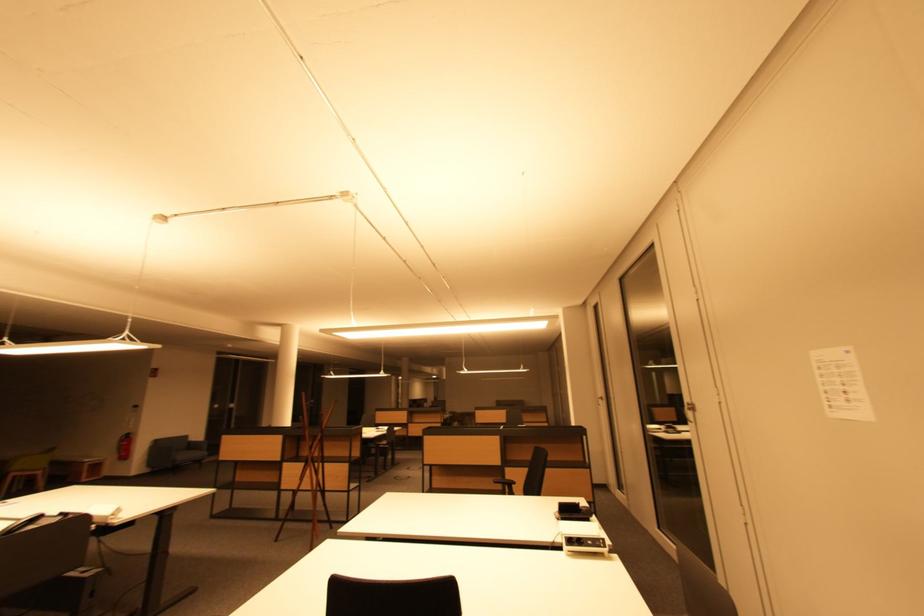
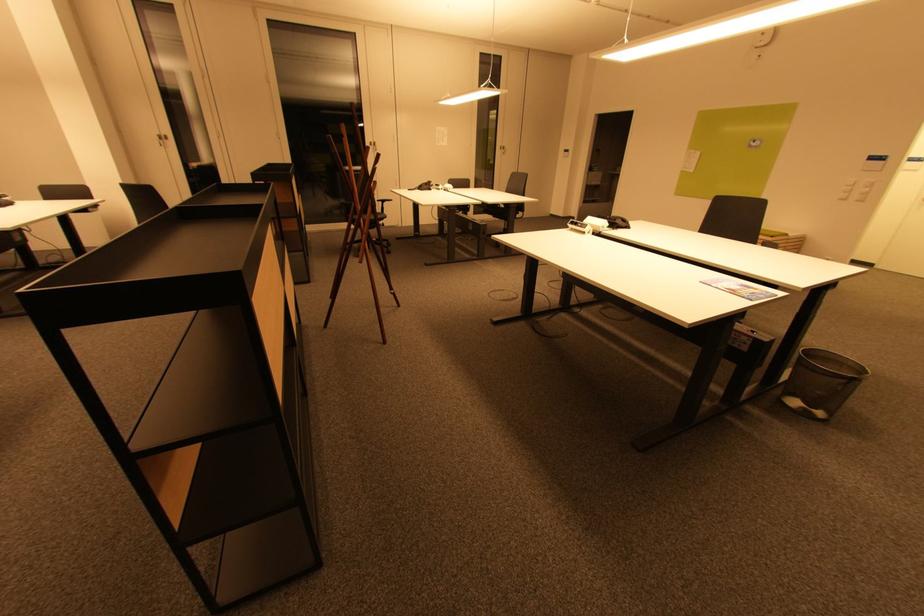
In the second image, find the point that corresponds to point (605, 400) in the first image.

(166, 140)